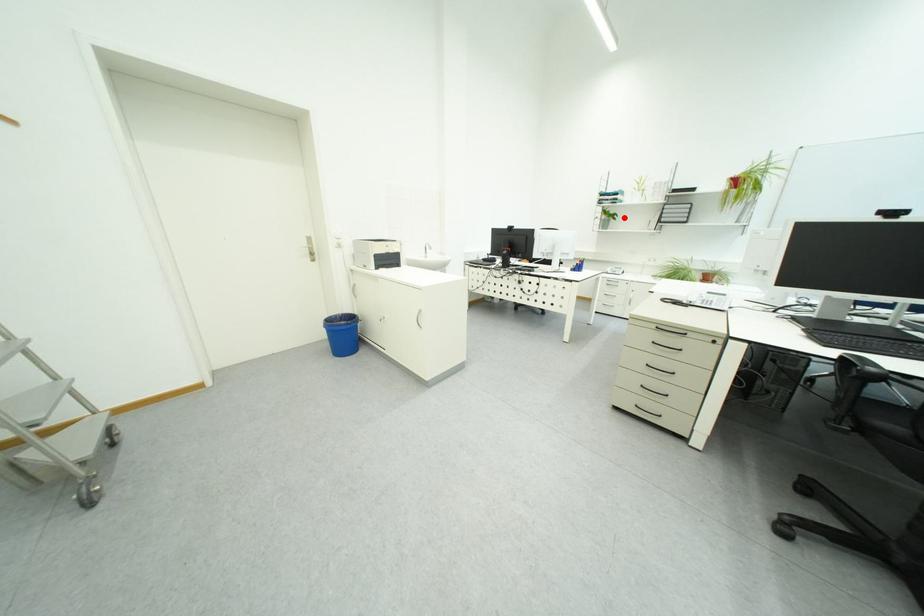
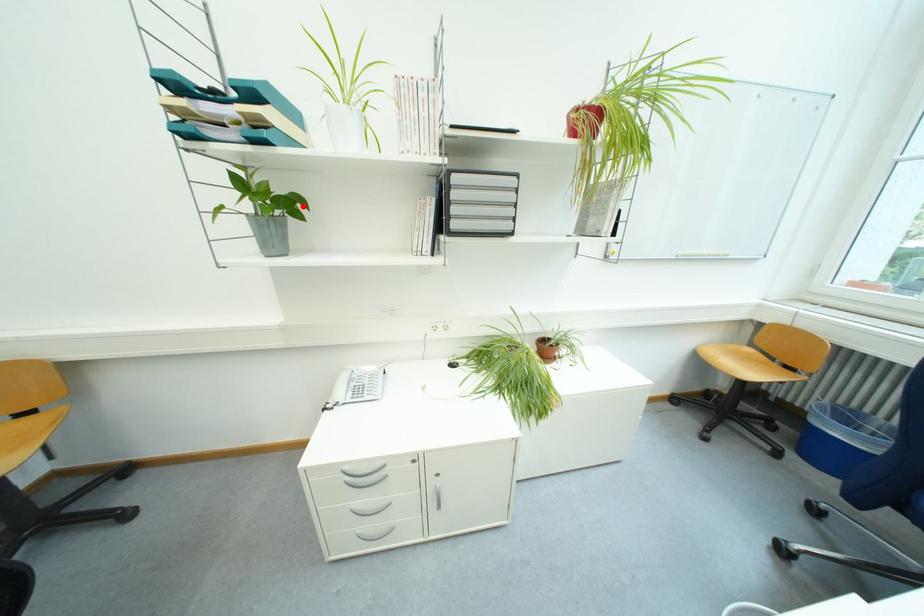
I am providing you with two images of the same scene from different viewpoints. A red point is marked on the first image and another point is marked on the second image. Is the marked point in image1 the same physical position as the marked point in image2?

Yes